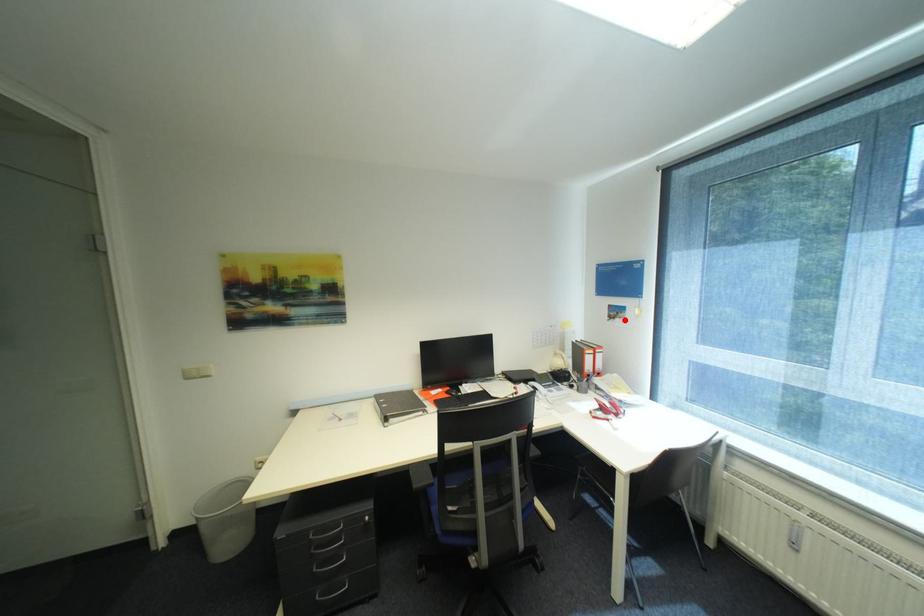
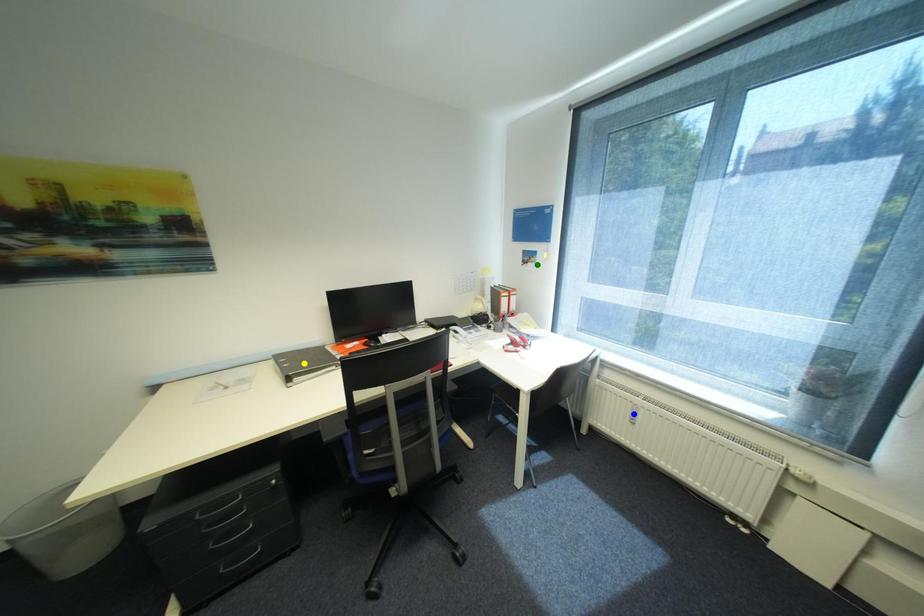
Question: I am providing you with two images of the same scene from different viewpoints. A red point is marked on the first image. You are given multiple points on the second image. Which point in image 2 is actually the same real-world point as the red point in image 1?

Choices:
 (A) green point
 (B) blue point
 (C) yellow point

Answer: (A)